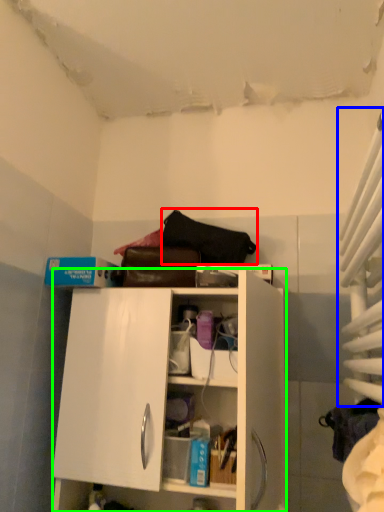
Question: Considering the real-world distances, which object is closest to handbag (highlighted by a red box)? curtain (highlighted by a blue box) or cabinetry (highlighted by a green box).

Choices:
 (A) curtain
 (B) cabinetry

Answer: (B)